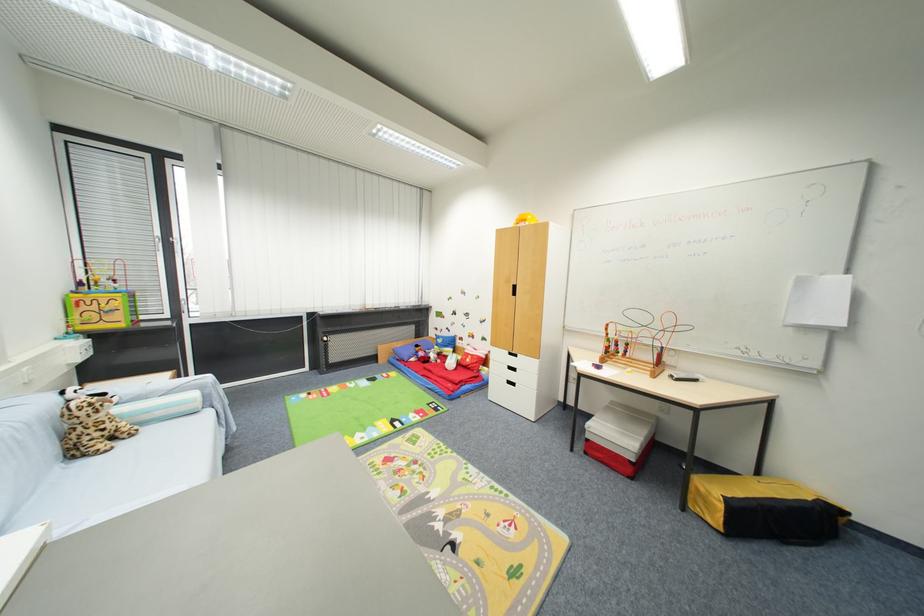
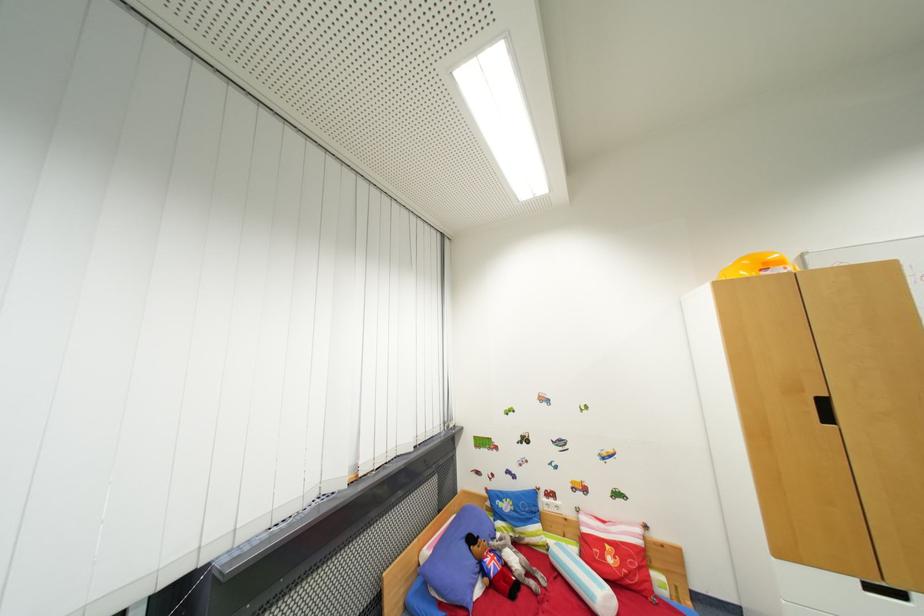
Locate, in the second image, the point that corresponds to (421,347) in the first image.

(477, 541)